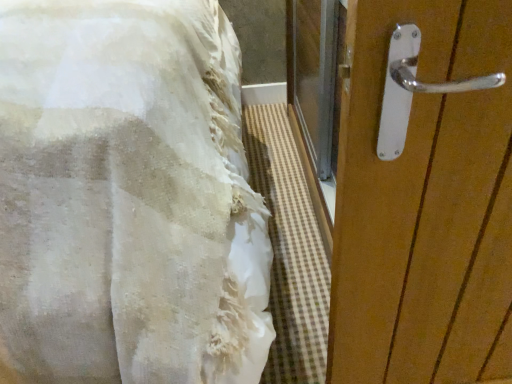
Find the location of a particular element. The width and height of the screenshot is (512, 384). white fabric bed at left is located at coordinates (127, 197).

Describe the element at coordinates (127, 197) in the screenshot. I see `white fabric bed at left` at that location.

The width and height of the screenshot is (512, 384). Identify the location of white fabric bed at left. (127, 197).